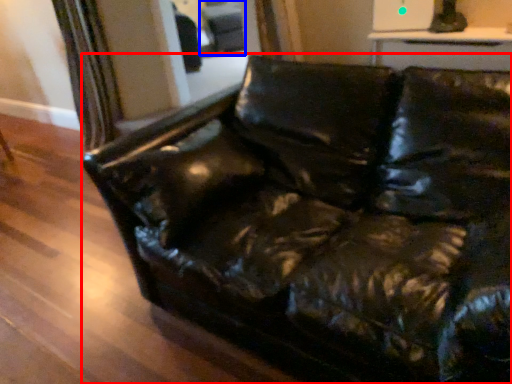
Question: Which of the following is the closest to the observer, studio couch (highlighted by a red box) or swivel chair (highlighted by a blue box)?

Choices:
 (A) studio couch
 (B) swivel chair

Answer: (A)